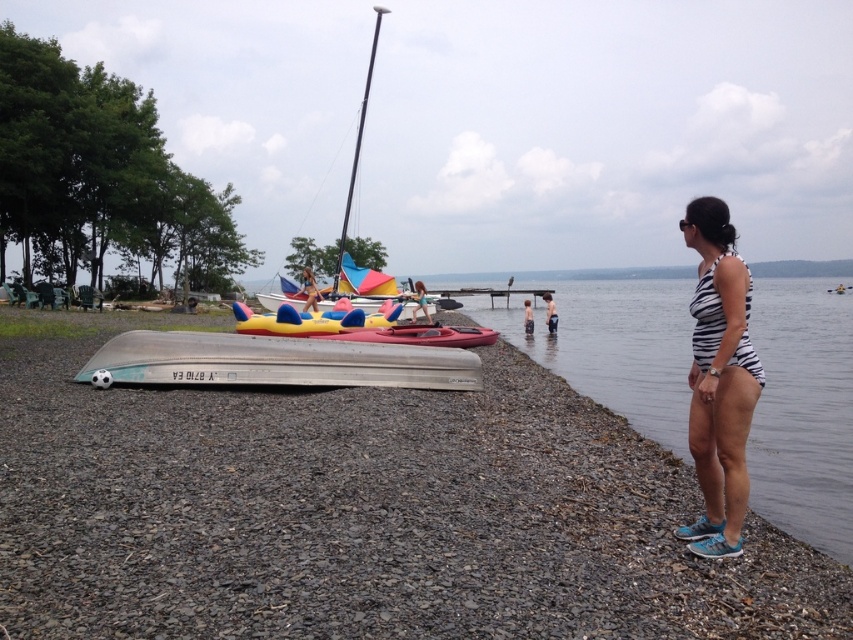
Which is in front, point (310, 496) or point (308, 285)?

Point (310, 496) is more forward.

This screenshot has height=640, width=853. What do you see at coordinates (358, 512) in the screenshot?
I see `smooth gray gravel at lower left` at bounding box center [358, 512].

Image resolution: width=853 pixels, height=640 pixels. In order to click on smooth gray gravel at lower left in this screenshot , I will do `click(358, 512)`.

Which is below, smooth gray gravel at lower left or striped swimsuit at lower right?

smooth gray gravel at lower left is lower down.

Is smooth gray gravel at lower left above striped swimsuit at lower right?

Actually, smooth gray gravel at lower left is below striped swimsuit at lower right.

Find the location of `smooth gray gravel at lower left`. smooth gray gravel at lower left is located at coordinates (358, 512).

Between multicolored inflatable boat at center and striped swimsuit at lower right, which one has less height?

striped swimsuit at lower right is shorter.

Is point (358, 113) less distant than point (529, 323)?

No, it is behind (529, 323).

Does point (322, 301) come in front of point (531, 316)?

Yes, it is.

Locate an element on the screen. The image size is (853, 640). multicolored inflatable boat at center is located at coordinates (354, 163).